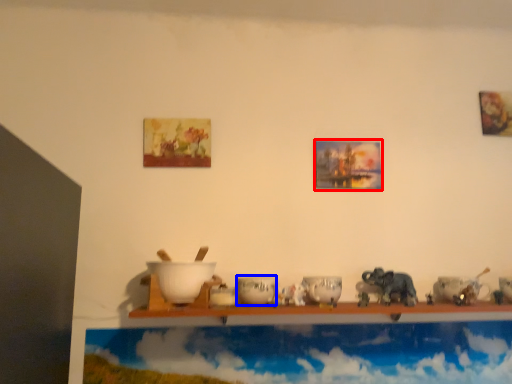
Question: Which of the following is the farthest to the observer, picture frame (highlighted by a red box) or tableware (highlighted by a blue box)?

Choices:
 (A) picture frame
 (B) tableware

Answer: (A)